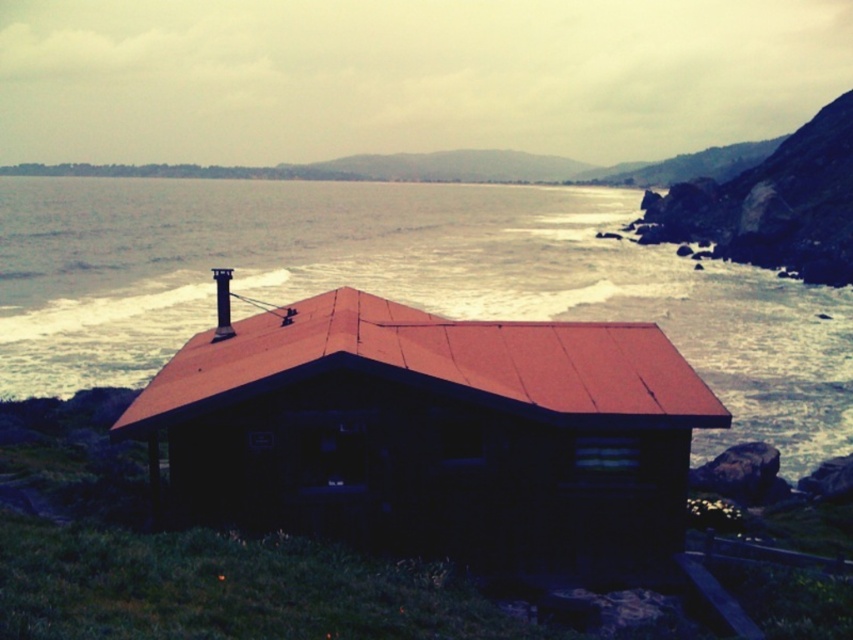
This screenshot has height=640, width=853. In order to click on oily gray water at center in this screenshot , I will do click(x=403, y=284).

Does oily gray water at center appear under wooden log cabin at center?

No, oily gray water at center is not below wooden log cabin at center.

Describe the element at coordinates (403, 284) in the screenshot. I see `oily gray water at center` at that location.

The image size is (853, 640). What are the coordinates of `oily gray water at center` in the screenshot? It's located at (403, 284).